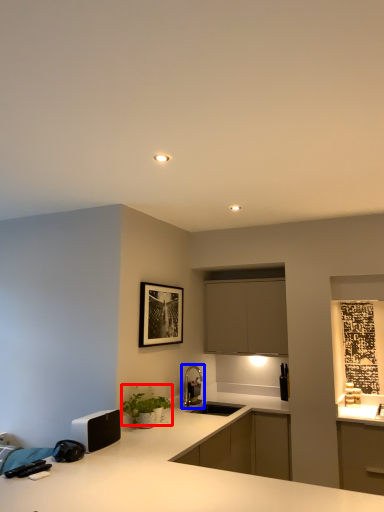
Question: Which point is further to the camera, plant (highlighted by a red box) or tap (highlighted by a blue box)?

Choices:
 (A) plant
 (B) tap

Answer: (B)